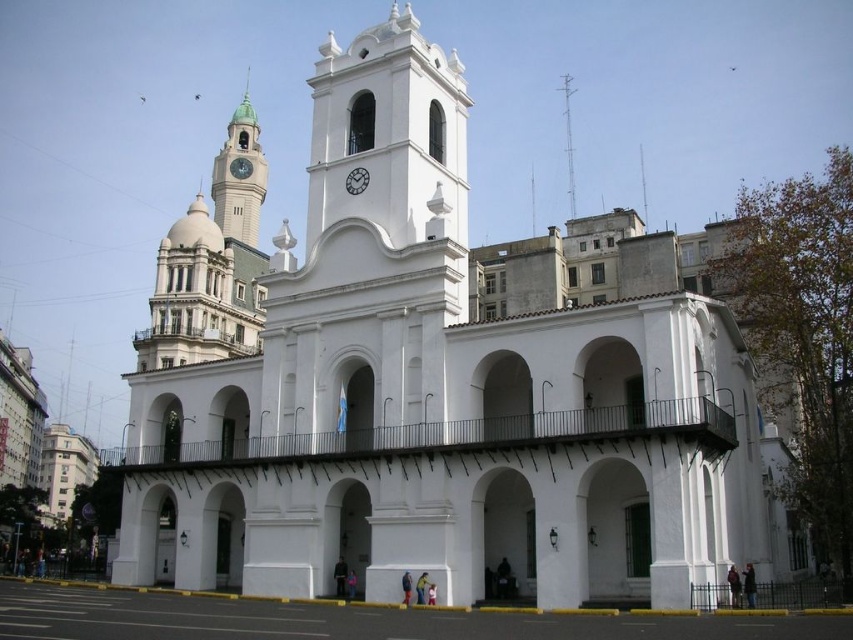
You are a drone operator trying to position a camera exactly at the center of the image. The camera must avoid any objects to capture a clear shot of the sky. Given the smooth silver spire at upper center, can you confirm if the spire will be in the way of the camera positioned at the center?

The smooth silver spire at upper center is located at point (567, 140) in 2D coordinates. The center of the image is at (426, 320). Since the spire is above and to the left of the center point, positioning the camera at the center would avoid the spire, allowing a clear shot of the sky.

You are a tourist standing in front of the building and want to take a photo that includes both the white smooth clock tower at center and the smooth silver spire at upper center. Which object should you position to the right side of your photo to ensure both are visible?

You should position the smooth silver spire at upper center to the right side of your photo because the white smooth clock tower at center is to the left of it, so placing the spire on the right will include both in the frame.